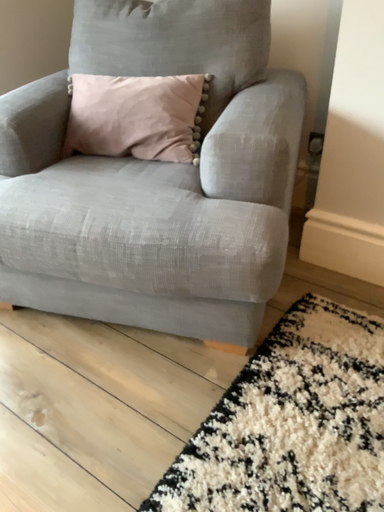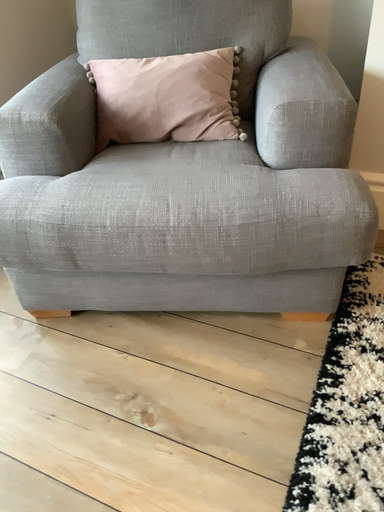
Question: How did the camera likely rotate when shooting the video?

Choices:
 (A) rotated right
 (B) rotated left

Answer: (A)